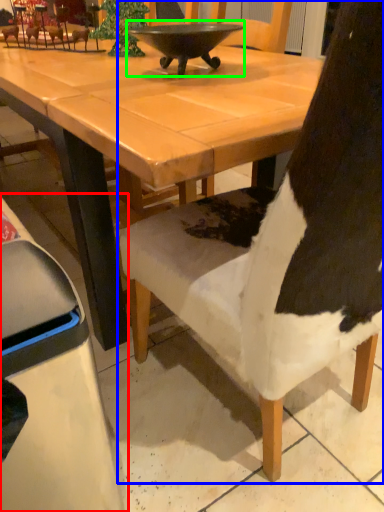
Question: Which is nearer to the chair (highlighted by a red box)? chair (highlighted by a blue box) or bowl (highlighted by a green box).

Choices:
 (A) chair
 (B) bowl

Answer: (A)